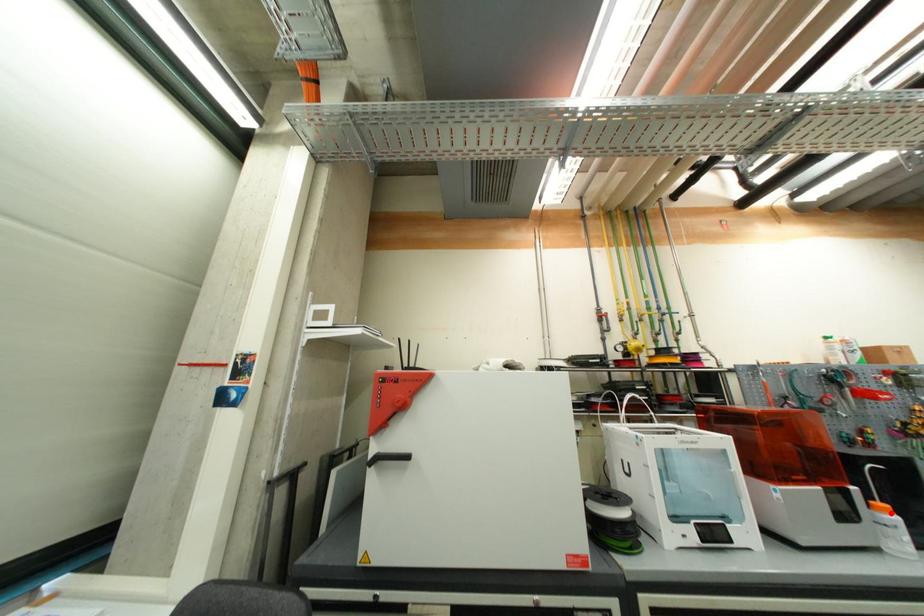
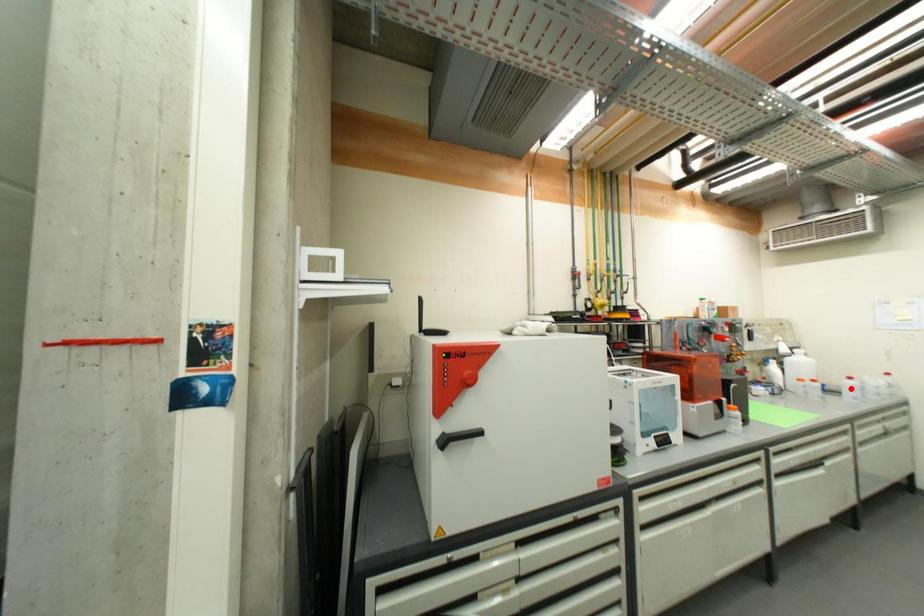
I am providing you with two images of the same scene from different viewpoints. A red point is marked on the first image and another point is marked on the second image. Does the point marked in image1 correspond to the same location as the one in image2?

No